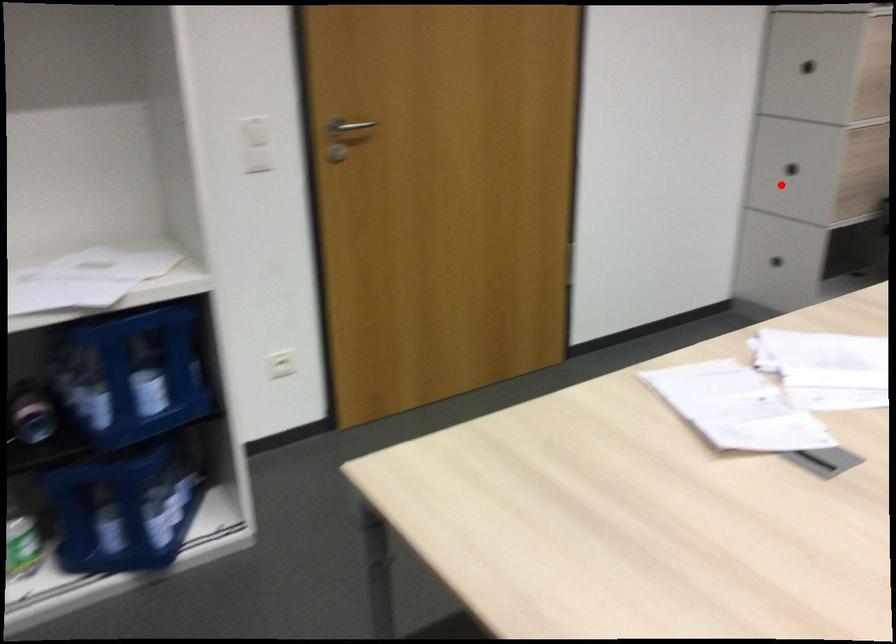
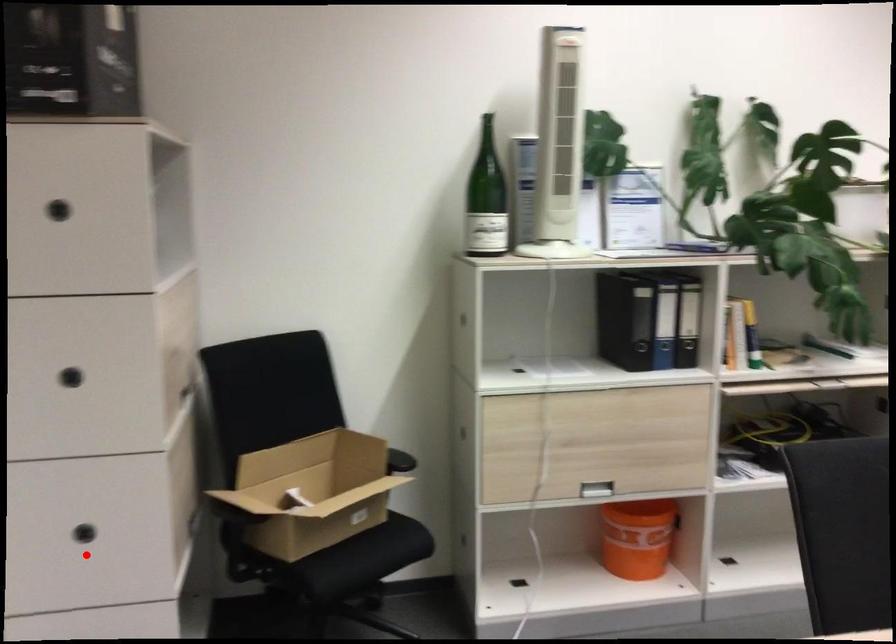
In the scene shown: I am providing you with two images of the same scene from different viewpoints. A red point is marked on the first image and another point is marked on the second image. Is the marked point in image1 the same physical position as the marked point in image2?

Yes